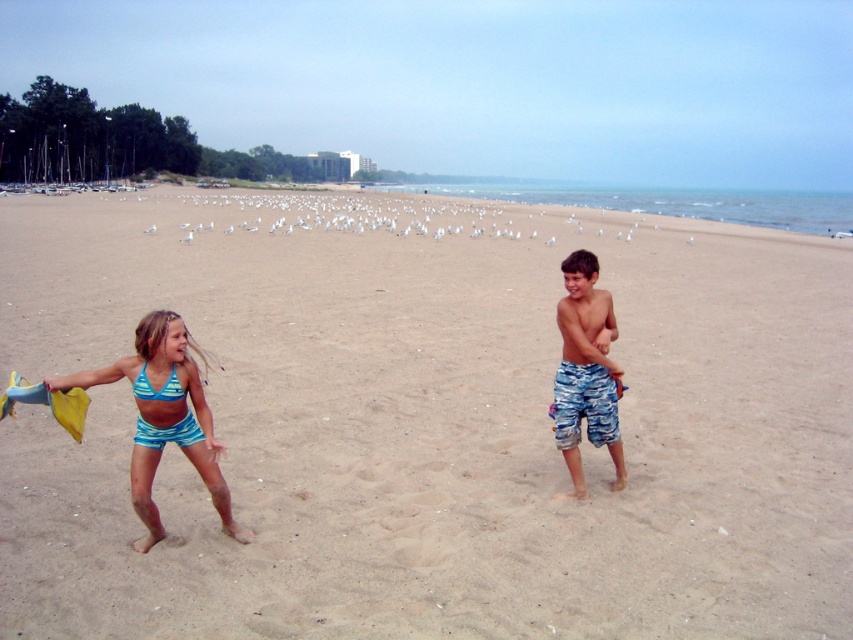
You are standing at the point marked as point (524, 481) on the beach. If you want to walk towards the ocean, which direction should you go?

The point (524, 481) is 6.02 meters away from the viewer, so you should walk forward towards the ocean.

Two children are playing on the beige sandy beach at center. The girl has a yellow and blue object in her hand, and the boy is standing with his arms crossed. How far apart are the two children?

The two children are 4.14 meters apart.

You are a photographer trying to capture a photo of both the blue striped swimsuit at lower left and the camouflage shorts at right. Which one should you focus on first to ensure both are in sharp focus?

You should focus on the blue striped swimsuit at lower left first because it is closer to the viewer than the camouflage shorts at right, so focusing on the closer object will help ensure both are in focus.